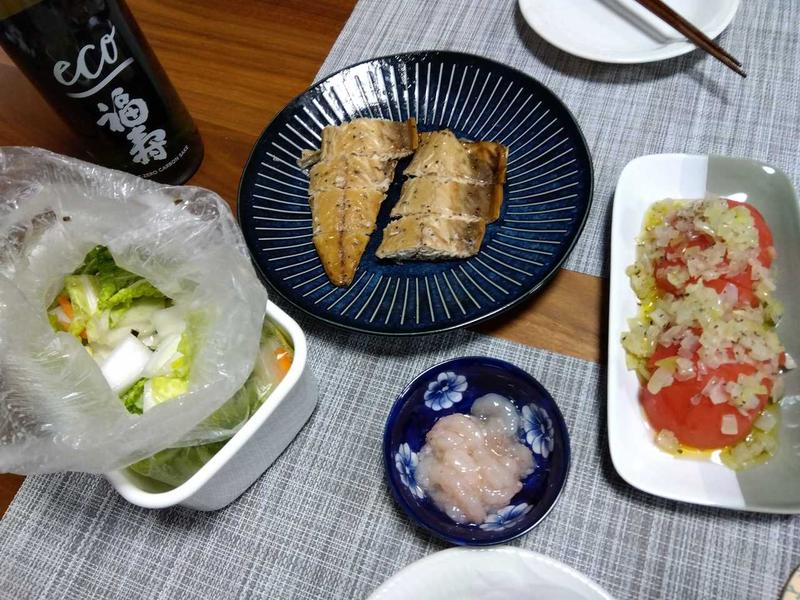
At what (x,y) coordinates should I click in order to perform the action: click on flowers decoration. Please return your answer as a coordinate pair (x, y). The width and height of the screenshot is (800, 600). Looking at the image, I should click on (453, 393), (402, 469), (540, 430), (506, 525).